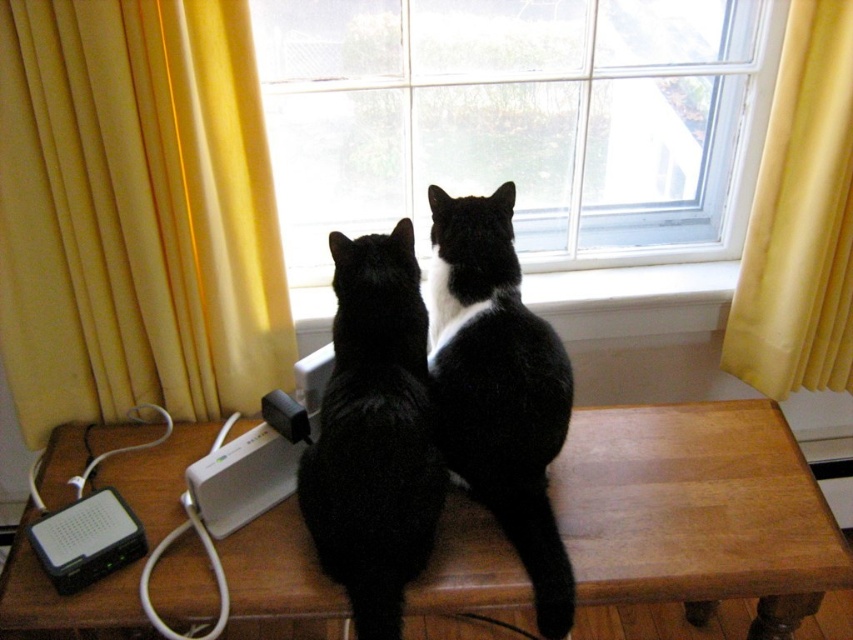
Question: Which point appears farthest from the camera in this image?

Choices:
 (A) (759, 164)
 (B) (664, 298)
 (C) (149, 150)
 (D) (512, 208)

Answer: (B)

Question: Can you confirm if transparent glass window at center is bigger than yellow fabric curtain at right?

Choices:
 (A) yes
 (B) no

Answer: (A)

Question: Estimate the real-world distances between objects in this image. Which object is farther from the transparent glass window at center?

Choices:
 (A) white smooth window sill at center
 (B) yellow fabric curtain at left
 (C) black fur cat at center
 (D) black matte fur cat at center

Answer: (D)

Question: From the image, what is the correct spatial relationship of yellow fabric curtain at right in relation to white smooth window sill at center?

Choices:
 (A) right
 (B) left

Answer: (A)

Question: Among these objects, which one is farthest from the camera?

Choices:
 (A) white smooth window sill at center
 (B) black matte fur cat at center
 (C) black fur cat at center
 (D) yellow fabric curtain at right

Answer: (A)

Question: Is yellow fabric curtain at left further to camera compared to white smooth window sill at center?

Choices:
 (A) no
 (B) yes

Answer: (A)